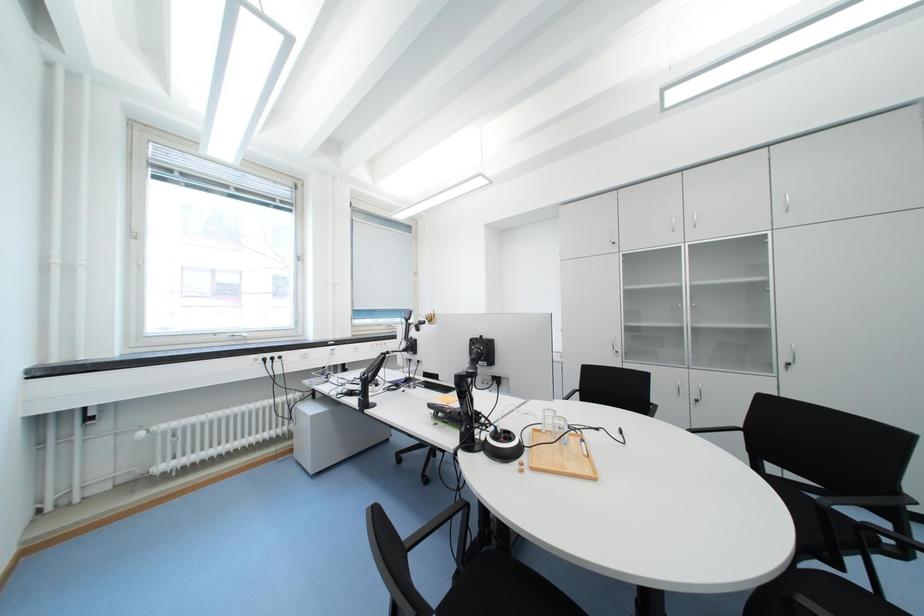
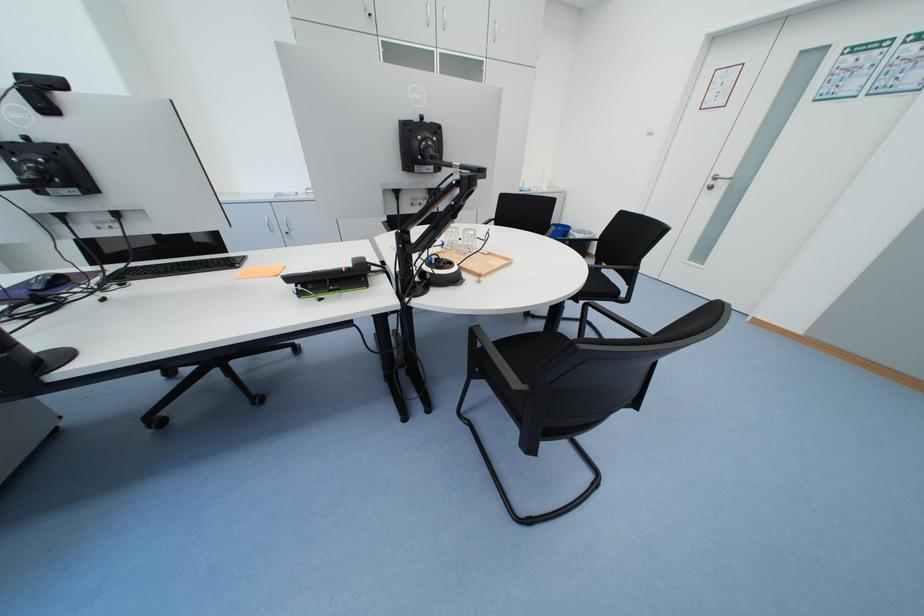
Based on the continuous images, in which direction is the camera rotating?

The camera rotated toward right-down.